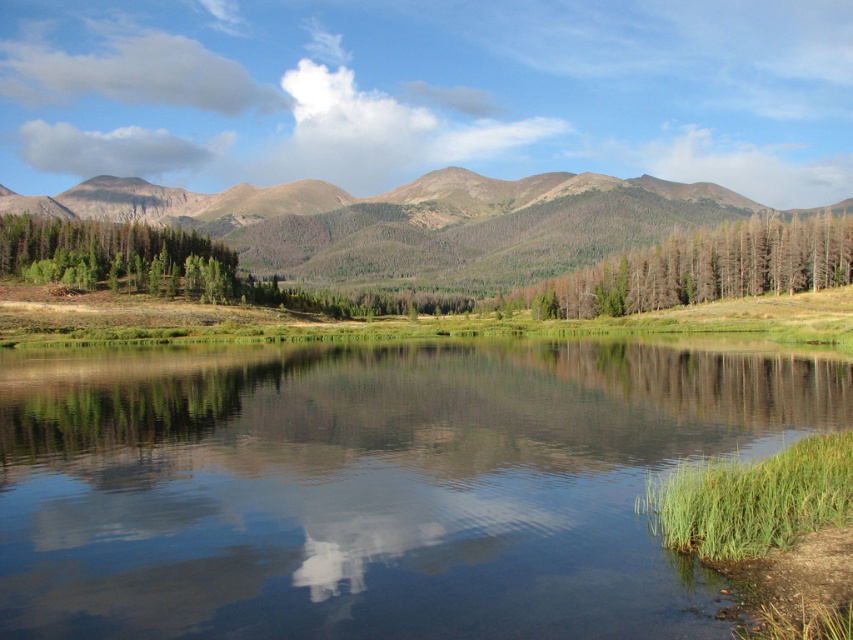
Question: Is green forested mountain at center positioned at the back of dead wood trees at center?

Choices:
 (A) yes
 (B) no

Answer: (A)

Question: Which point appears farthest from the camera in this image?

Choices:
 (A) (213, 449)
 (B) (445, 212)
 (C) (807, 282)

Answer: (B)

Question: Does green forested mountain at center appear under dead wood trees at center?

Choices:
 (A) yes
 (B) no

Answer: (B)

Question: Which point is farther from the camera taking this photo?

Choices:
 (A) (532, 275)
 (B) (254, 525)
 (C) (643, 268)

Answer: (A)

Question: Does green forested mountain at center have a smaller size compared to dead wood trees at center?

Choices:
 (A) yes
 (B) no

Answer: (B)

Question: Which object is closer to the camera taking this photo?

Choices:
 (A) dead wood trees at center
 (B) green grassy shore at lower right

Answer: (B)